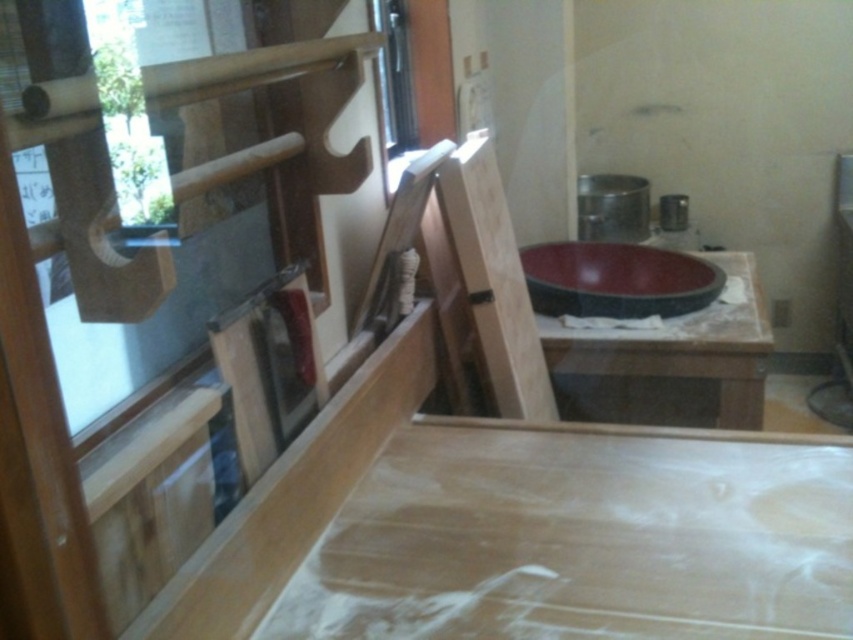
You are a contractor inspecting the workspace. You need to place a new tool box on the smooth light brown plywood at center. According to the coordinates provided, where exactly on the workspace should you position the toolbox?

The smooth light brown plywood at center is located at point (579, 540), so you should position the toolbox at those coordinates to ensure it is placed correctly on the smooth light brown plywood at center.

You are an interior designer assessing the workspace. You notice the smooth light brown plywood at center and the matte black bowl at center. Which object is positioned lower in the scene?

The smooth light brown plywood at center is positioned below the matte black bowl at center, so it is lower in the scene.

From the picture: You are a contractor inspecting the construction site. You see the smooth light brown plywood at center and the matte black sink at center. Which object is positioned to the left?

The smooth light brown plywood at center is positioned to the left of the matte black sink at center.